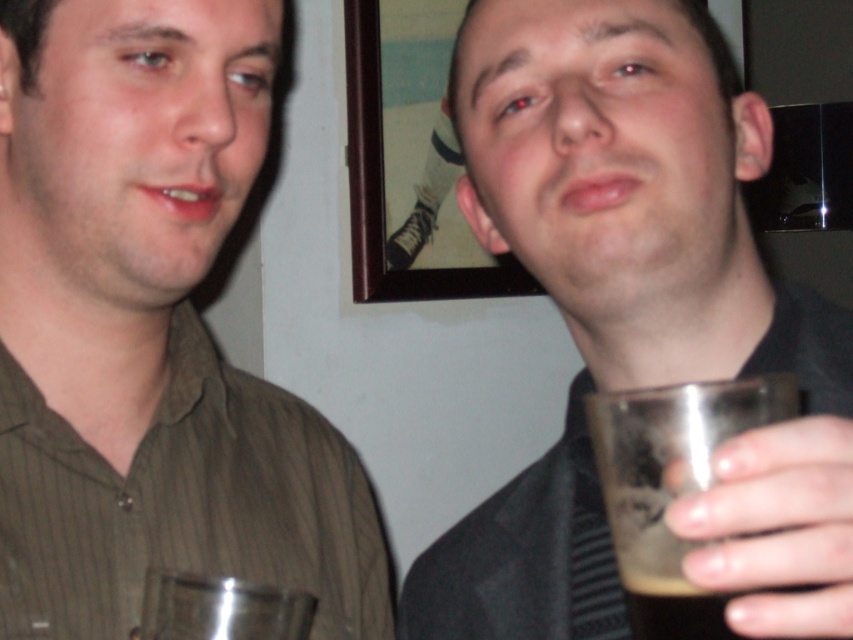
Who is more distant from viewer, (16, 554) or (662, 392)?

The point (16, 554) is behind.

Is point (164, 499) in front of point (689, 417)?

That is False.

What do you see at coordinates (149, 332) in the screenshot? The image size is (853, 640). I see `matte brown shirt at left` at bounding box center [149, 332].

Where is `matte brown shirt at left`? This screenshot has height=640, width=853. matte brown shirt at left is located at coordinates (149, 332).

Which is in front, point (173, 451) or point (753, 145)?

Point (753, 145) is more forward.

Does matte brown shirt at left have a lesser width compared to clear plastic cup at upper right?

Yes, matte brown shirt at left is thinner than clear plastic cup at upper right.

Between point (47, 64) and point (804, 614), which one is positioned behind?

The point (47, 64) is more distant.

Find the location of a particular element. This screenshot has width=853, height=640. matte brown shirt at left is located at coordinates (149, 332).

Does clear plastic cup at upper right come in front of translucent glass at right?

Yes.

This screenshot has height=640, width=853. What do you see at coordinates (637, 317) in the screenshot?
I see `clear plastic cup at upper right` at bounding box center [637, 317].

Where is `clear plastic cup at upper right`? This screenshot has width=853, height=640. clear plastic cup at upper right is located at coordinates (637, 317).